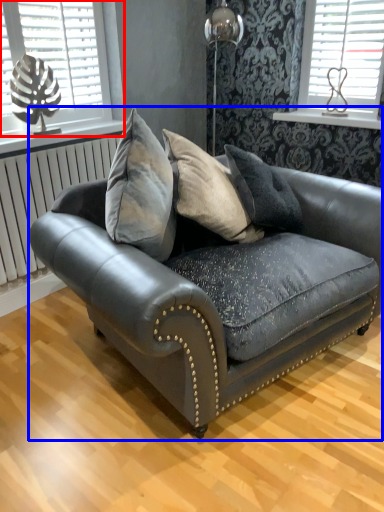
Question: Which point is closer to the camera, window (highlighted by a red box) or studio couch (highlighted by a blue box)?

Choices:
 (A) window
 (B) studio couch

Answer: (B)